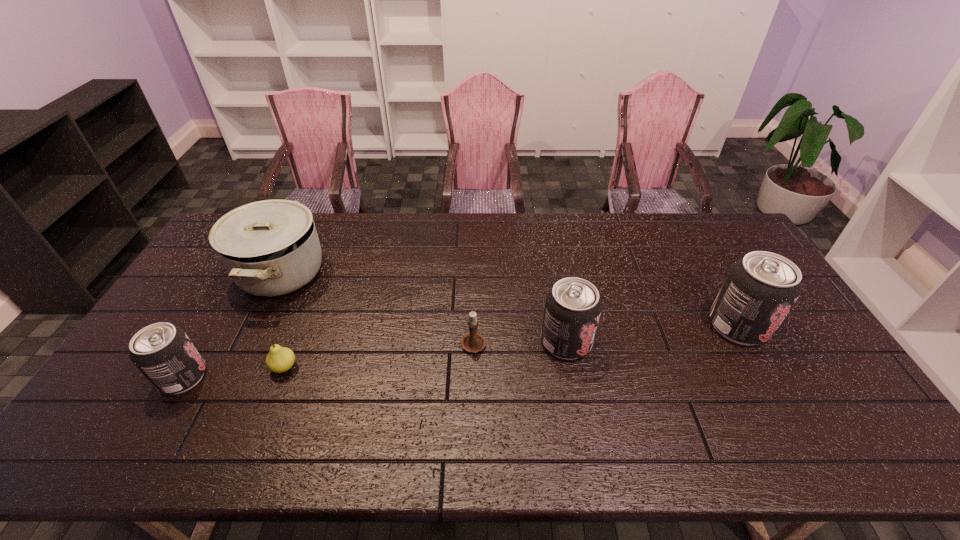
Where is `location for an additional pop_(soda) to make spacing equal`? Image resolution: width=960 pixels, height=540 pixels. location for an additional pop_(soda) to make spacing equal is located at coordinates (381, 359).